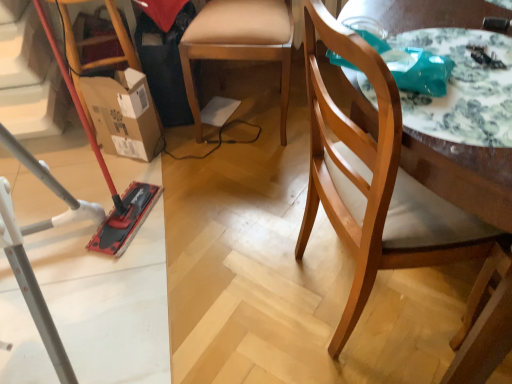
Question: Looking at their shapes, would you say white glossy table at upper right is wider or thinner than brushed metal vacuum cleaner at left?

Choices:
 (A) thin
 (B) wide

Answer: (A)

Question: From the image's perspective, is white glossy table at upper right located above or below brushed metal vacuum cleaner at left?

Choices:
 (A) above
 (B) below

Answer: (B)

Question: Estimate the real-world distances between objects in this image. Which object is closer to the white glossy table at upper right?

Choices:
 (A) wooden chair at right, which is the first chair from front to back
 (B) brushed metal vacuum cleaner at left
 (C) light brown wooden chair at center, the 2th chair in the front-to-back sequence
 (D) cardboard box at left

Answer: (A)

Question: Which object is positioned farthest from the wooden chair at right, which is the first chair from front to back?

Choices:
 (A) cardboard box at left
 (B) brushed metal vacuum cleaner at left
 (C) light brown wooden chair at center, the 2th chair in the front-to-back sequence
 (D) white glossy table at upper right

Answer: (B)